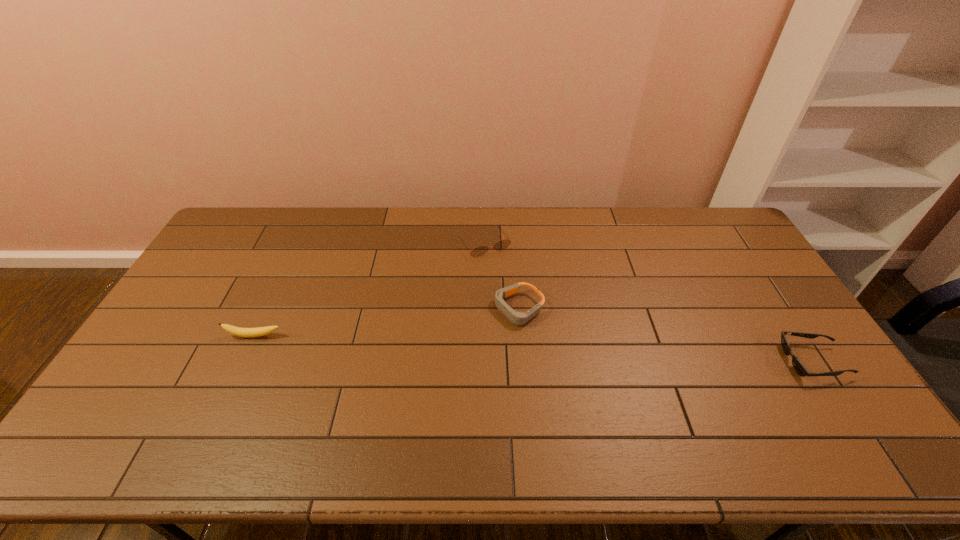
I want to click on vacant space situated 0.270m on the front-facing side of the rightmost object, so click(688, 361).

Locate an element on the screen. The height and width of the screenshot is (540, 960). vacant space located on the front and back of the second farthest object is located at coordinates (462, 340).

Locate an element on the screen. The width and height of the screenshot is (960, 540). free space located 0.360m on the front and back of the second farthest object is located at coordinates (394, 378).

You are a GUI agent. You are given a task and a screenshot of the screen. Output one action in this format:
    pyautogui.click(x=<x>, y=<y>)
    Task: Click on the free space located 0.330m on the front and back of the second farthest object
    The width and height of the screenshot is (960, 540).
    Given the screenshot: What is the action you would take?
    pyautogui.click(x=403, y=373)

Locate an element on the screen. vacant space positioned 0.380m on the face of the farther sunglasses is located at coordinates (550, 336).

Identify the location of vacant space situated on the face of the farther sunglasses. (505, 272).

Locate an element on the screen. Image resolution: width=960 pixels, height=540 pixels. blank area located 0.390m on the face of the farther sunglasses is located at coordinates (551, 339).

Find the location of a particular element. This screenshot has width=960, height=540. object located at the far edge is located at coordinates (502, 244).

At what (x,y) coordinates should I click in order to perform the action: click on object situated at the right edge. Please return your answer as a coordinate pair (x, y). This screenshot has width=960, height=540. Looking at the image, I should click on (798, 366).

Where is `free space at the far edge`? free space at the far edge is located at coordinates (639, 214).